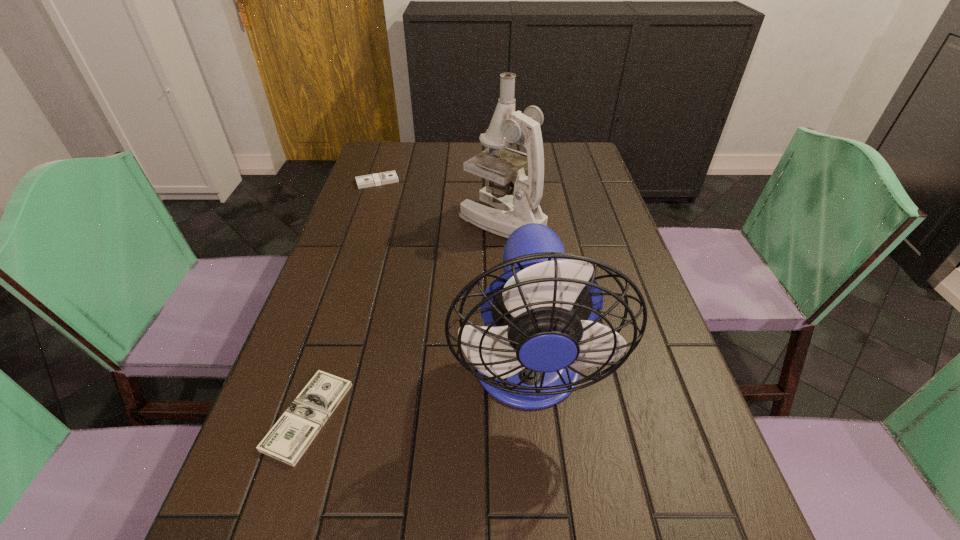
Identify the location of object that is positioned at the right edge. This screenshot has width=960, height=540. (541, 314).

You are a GUI agent. You are given a task and a screenshot of the screen. Output one action in this format:
    pyautogui.click(x=<x>, y=<y>)
    Task: Click on the object at the far left corner
    The height and width of the screenshot is (540, 960).
    Given the screenshot: What is the action you would take?
    pyautogui.click(x=389, y=177)

At what (x,y) coordinates should I click in order to perform the action: click on free spot at the far edge of the desktop. Please return your answer as a coordinate pair (x, y). Looking at the image, I should click on (420, 164).

Find the location of `vacant space at the right edge of the desktop`. vacant space at the right edge of the desktop is located at coordinates (703, 422).

The height and width of the screenshot is (540, 960). In the image, there is a desktop. What are the coordinates of `vacant region at the far left corner` in the screenshot? It's located at (405, 151).

The image size is (960, 540). I want to click on vacant point located between the shortest object and the farthest object, so click(x=343, y=299).

I want to click on free spot between the fan and the shorter dollar, so click(x=418, y=395).

Locate an element on the screen. empty space that is in between the microscope and the shortest object is located at coordinates (405, 318).

Image resolution: width=960 pixels, height=540 pixels. I want to click on empty space that is in between the microscope and the taller dollar, so click(440, 201).

This screenshot has width=960, height=540. I want to click on free space that is in between the second farthest object and the nearer dollar, so point(405,318).